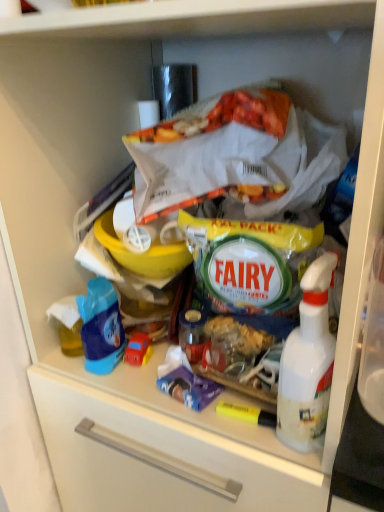
Question: Considering the relative positions of rubber car at center and blue plastic toy car at left in the image provided, is rubber car at center behind blue plastic toy car at left?

Choices:
 (A) yes
 (B) no

Answer: (A)

Question: Is rubber car at center not near blue plastic toy car at left?

Choices:
 (A) no
 (B) yes

Answer: (A)

Question: Is rubber car at center touching blue plastic toy car at left?

Choices:
 (A) no
 (B) yes

Answer: (B)

Question: Can you confirm if rubber car at center is taller than blue plastic toy car at left?

Choices:
 (A) no
 (B) yes

Answer: (A)

Question: From the image's perspective, is rubber car at center above blue plastic toy car at left?

Choices:
 (A) no
 (B) yes

Answer: (A)

Question: In the image, is rubber car at center on the left side or the right side of blue plastic toy car at left?

Choices:
 (A) left
 (B) right

Answer: (B)

Question: Considering the positions of rubber car at center and blue plastic toy car at left in the image, is rubber car at center taller or shorter than blue plastic toy car at left?

Choices:
 (A) short
 (B) tall

Answer: (A)

Question: Considering the positions of rubber car at center and blue plastic toy car at left in the image, is rubber car at center wider or thinner than blue plastic toy car at left?

Choices:
 (A) wide
 (B) thin

Answer: (B)

Question: Is rubber car at center spatially inside blue plastic toy car at left, or outside of it?

Choices:
 (A) outside
 (B) inside

Answer: (A)

Question: In terms of height, does blue plastic toy car at left look taller or shorter compared to rubber car at center?

Choices:
 (A) short
 (B) tall

Answer: (B)

Question: Is blue plastic toy car at left in front of or behind rubber car at center in the image?

Choices:
 (A) front
 (B) behind

Answer: (A)

Question: Is point (92, 337) positioned closer to the camera than point (127, 354)?

Choices:
 (A) farther
 (B) closer

Answer: (B)

Question: Choose the correct answer: Is blue plastic toy car at left inside rubber car at center or outside it?

Choices:
 (A) outside
 (B) inside

Answer: (A)

Question: From a real-world perspective, is white plastic spray bottle at right physically located above or below rubber car at center?

Choices:
 (A) below
 (B) above

Answer: (B)

Question: Considering the positions of white plastic spray bottle at right and rubber car at center in the image, is white plastic spray bottle at right bigger or smaller than rubber car at center?

Choices:
 (A) big
 (B) small

Answer: (A)